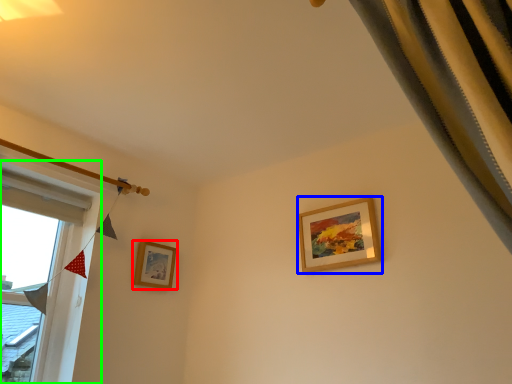
Question: Estimate the real-world distances between objects in this image. Which object is closer to picture frame (highlighted by a red box), picture frame (highlighted by a blue box) or window (highlighted by a green box)?

Choices:
 (A) picture frame
 (B) window

Answer: (B)